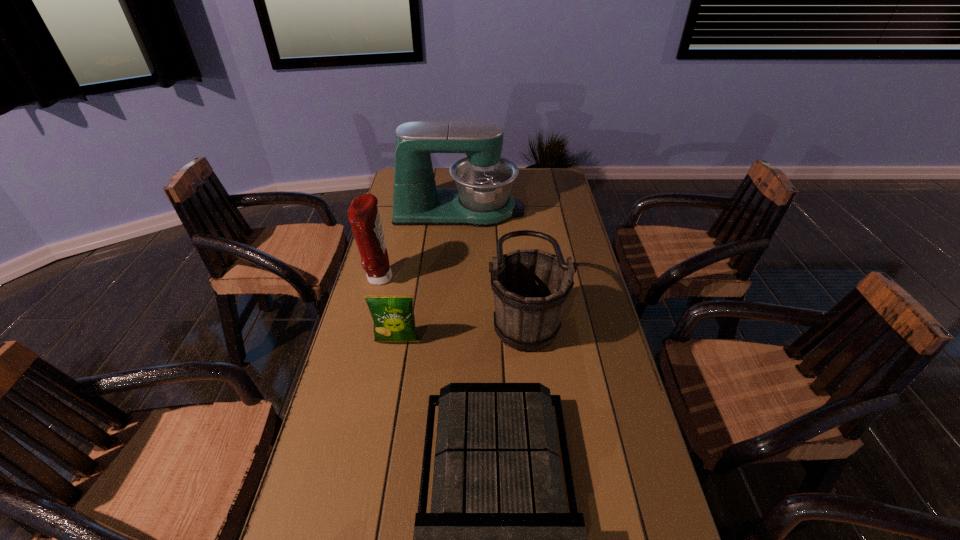
At what (x,y) coordinates should I click in order to perform the action: click on empty space between the bucket and the second shortest object. Please return your answer as a coordinate pair (x, y). The image size is (960, 540). Looking at the image, I should click on coord(461,328).

Where is `object that is the third nearest to the mixer`? The width and height of the screenshot is (960, 540). object that is the third nearest to the mixer is located at coordinates (393, 315).

The width and height of the screenshot is (960, 540). In order to click on object that stands as the closest to the fourth tallest object in this screenshot , I will do `click(363, 214)`.

The image size is (960, 540). Identify the location of free space that satisfies the following two spatial constraints: 1. on the handle side of the third shortest object; 2. on the front-facing side of the fourth tallest object. (528, 341).

You are a GUI agent. You are given a task and a screenshot of the screen. Output one action in this format:
    pyautogui.click(x=<x>, y=<y>)
    Task: Click on the free point that satisfies the following two spatial constraints: 1. on the front-facing side of the mixer; 2. on the front-facing side of the crisp (potato chip)
    The width and height of the screenshot is (960, 540).
    Given the screenshot: What is the action you would take?
    pyautogui.click(x=451, y=341)